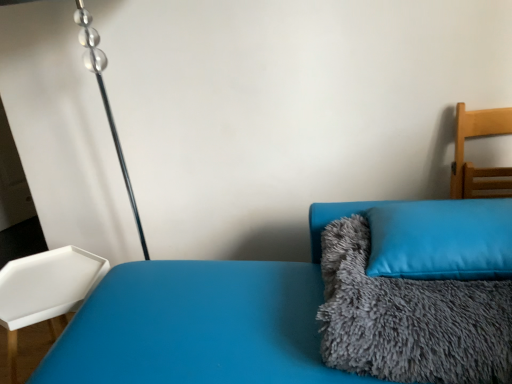
In order to face blue fuzzy couch at center, should I rotate leftwards or rightwards?

You should rotate right by 7.665 degrees.

Image resolution: width=512 pixels, height=384 pixels. Find the location of `white plastic tray at left, the 1th furniture when ordered from bottom to top`. white plastic tray at left, the 1th furniture when ordered from bottom to top is located at coordinates (45, 291).

Image resolution: width=512 pixels, height=384 pixels. What do you see at coordinates (441, 239) in the screenshot?
I see `blue soft cushion at right` at bounding box center [441, 239].

Where is `blue fuzzy couch at center`? The width and height of the screenshot is (512, 384). blue fuzzy couch at center is located at coordinates (203, 322).

Is white plastic tray at left, which ranks as the 1th furniture in left-to-right order, looking in the opposite direction of blue fuzzy couch at center?

No, white plastic tray at left, which ranks as the 1th furniture in left-to-right order, is not facing away from blue fuzzy couch at center.

Looking at this image, can you confirm if white plastic tray at left, the 1th furniture when ordered from bottom to top, is positioned to the left of blue fuzzy couch at center?

Correct, you'll find white plastic tray at left, the 1th furniture when ordered from bottom to top, to the left of blue fuzzy couch at center.

Is white plastic tray at left, which ranks as the 1th furniture in left-to-right order, positioned behind blue fuzzy couch at center?

Yes, the depth of white plastic tray at left, which ranks as the 1th furniture in left-to-right order, is greater than that of blue fuzzy couch at center.

Is white plastic tray at left, which ranks as the 1th furniture in left-to-right order, thinner than blue fuzzy couch at center?

Yes, white plastic tray at left, which ranks as the 1th furniture in left-to-right order, is thinner than blue fuzzy couch at center.

From the image's perspective, which one is positioned higher, blue fuzzy couch at center or blue soft cushion at right?

blue soft cushion at right.

Can you confirm if blue fuzzy couch at center is taller than blue soft cushion at right?

Yes, blue fuzzy couch at center is taller than blue soft cushion at right.

Is the depth of blue fuzzy couch at center greater than that of blue soft cushion at right?

No, blue fuzzy couch at center is closer to the camera.

Are gray fluffy blanket at right and blue soft cushion at right located far from each other?

gray fluffy blanket at right is actually quite close to blue soft cushion at right.

From the picture: Does gray fluffy blanket at right turn towards blue soft cushion at right?

No, gray fluffy blanket at right is not aimed at blue soft cushion at right.

Is point (423, 358) positioned after point (418, 255)?

No.

Is gray fluffy blanket at right not inside blue soft cushion at right?

Yes, gray fluffy blanket at right is not within blue soft cushion at right.

Could you measure the distance between white plastic tray at left, arranged as the second furniture when viewed from the top, and light wood chair at right, arranged as the 2th furniture when viewed from the left?

A distance of 4.28 feet exists between white plastic tray at left, arranged as the second furniture when viewed from the top, and light wood chair at right, arranged as the 2th furniture when viewed from the left.

Between white plastic tray at left, which ranks as the 1th furniture in left-to-right order, and light wood chair at right, arranged as the 2th furniture when viewed from the left, which one is positioned behind?

white plastic tray at left, which ranks as the 1th furniture in left-to-right order, is behind.

Considering the relative sizes of white plastic tray at left, which ranks as the 1th furniture in left-to-right order, and light wood chair at right, arranged as the 2th furniture when viewed from the left, in the image provided, is white plastic tray at left, which ranks as the 1th furniture in left-to-right order, smaller than light wood chair at right, arranged as the 2th furniture when viewed from the left,?

Incorrect, white plastic tray at left, which ranks as the 1th furniture in left-to-right order, is not smaller in size than light wood chair at right, arranged as the 2th furniture when viewed from the left.

Which object is positioned more to the left, white plastic tray at left, which ranks as the 1th furniture in left-to-right order, or light wood chair at right, placed as the 2th furniture when sorted from bottom to top?

white plastic tray at left, which ranks as the 1th furniture in left-to-right order, is more to the left.

Is light wood chair at right, placed as the 2th furniture when sorted from bottom to top, taller or shorter than gray fluffy blanket at right?

In the image, light wood chair at right, placed as the 2th furniture when sorted from bottom to top, appears to be taller than gray fluffy blanket at right.

Is gray fluffy blanket at right at the back of light wood chair at right, arranged as the 1th furniture when viewed from the top?

That's not correct — light wood chair at right, arranged as the 1th furniture when viewed from the top, is not looking away from gray fluffy blanket at right.

Which of these two, light wood chair at right, arranged as the 2th furniture when viewed from the left, or gray fluffy blanket at right, is smaller?

light wood chair at right, arranged as the 2th furniture when viewed from the left.

Considering the relative sizes of light wood chair at right, placed as the 2th furniture when sorted from bottom to top, and gray fluffy blanket at right in the image provided, is light wood chair at right, placed as the 2th furniture when sorted from bottom to top, wider than gray fluffy blanket at right?

In fact, light wood chair at right, placed as the 2th furniture when sorted from bottom to top, might be narrower than gray fluffy blanket at right.

From their relative heights in the image, would you say blue soft cushion at right is taller or shorter than gray fluffy blanket at right?

Considering their sizes, blue soft cushion at right has less height than gray fluffy blanket at right.

Could you tell me if blue soft cushion at right is facing gray fluffy blanket at right?

No, blue soft cushion at right is not turned towards gray fluffy blanket at right.

Would you say blue soft cushion at right is outside gray fluffy blanket at right?

No, blue soft cushion at right is inside or overlapping with gray fluffy blanket at right.

Does white plastic tray at left, the 1th furniture when ordered from bottom to top, appear on the left side of blue soft cushion at right?

Indeed, white plastic tray at left, the 1th furniture when ordered from bottom to top, is positioned on the left side of blue soft cushion at right.

Considering the sizes of white plastic tray at left, marked as the 2th furniture in a right-to-left arrangement, and blue soft cushion at right in the image, is white plastic tray at left, marked as the 2th furniture in a right-to-left arrangement, wider or thinner than blue soft cushion at right?

Considering their sizes, white plastic tray at left, marked as the 2th furniture in a right-to-left arrangement, looks slimmer than blue soft cushion at right.

Where is `furniture below the blue soft cushion at right (from a real-world perspective)`? furniture below the blue soft cushion at right (from a real-world perspective) is located at coordinates (45, 291).

Is white plastic tray at left, the 1th furniture when ordered from bottom to top, oriented away from blue soft cushion at right?

No, white plastic tray at left, the 1th furniture when ordered from bottom to top,'s orientation is not away from blue soft cushion at right.

There is a white plastic tray at left, which ranks as the 1th furniture in left-to-right order. At what (x,y) coordinates should I click in order to perform the action: click on couch above it (from a real-world perspective). Please return your answer as a coordinate pair (x, y). Image resolution: width=512 pixels, height=384 pixels. Looking at the image, I should click on (203, 322).

At what (x,y) coordinates should I click in order to perform the action: click on couch below the blue soft cushion at right (from a real-world perspective). Please return your answer as a coordinate pair (x, y). This screenshot has width=512, height=384. Looking at the image, I should click on (203, 322).

Estimate the real-world distances between objects in this image. Which object is closer to blue fuzzy couch at center, gray fluffy blanket at right or light wood chair at right, the 1th furniture from the right?

gray fluffy blanket at right.

When comparing their distances from blue fuzzy couch at center, does blue soft cushion at right or light wood chair at right, arranged as the 1th furniture when viewed from the top, seem closer?

blue soft cushion at right.

Which object lies further to the anchor point blue soft cushion at right, white plastic tray at left, the 1th furniture when ordered from bottom to top, or gray fluffy blanket at right?

Among the two, white plastic tray at left, the 1th furniture when ordered from bottom to top, is located further to blue soft cushion at right.

Which object lies further to the anchor point blue soft cushion at right, blue fuzzy couch at center or white plastic tray at left, marked as the 2th furniture in a right-to-left arrangement?

white plastic tray at left, marked as the 2th furniture in a right-to-left arrangement.

From the image, which object appears to be nearer to blue fuzzy couch at center, light wood chair at right, placed as the 2th furniture when sorted from bottom to top, or white plastic tray at left, marked as the 2th furniture in a right-to-left arrangement?

white plastic tray at left, marked as the 2th furniture in a right-to-left arrangement, is positioned closer to the anchor blue fuzzy couch at center.

Which object lies further to the anchor point blue soft cushion at right, light wood chair at right, the 1th furniture from the right, or blue fuzzy couch at center?

Among the two, light wood chair at right, the 1th furniture from the right, is located further to blue soft cushion at right.

Looking at the image, which one is located closer to white plastic tray at left, which ranks as the 1th furniture in left-to-right order, gray fluffy blanket at right or blue fuzzy couch at center?

The object closer to white plastic tray at left, which ranks as the 1th furniture in left-to-right order, is blue fuzzy couch at center.

Consider the image. Which object lies further to the anchor point blue fuzzy couch at center, gray fluffy blanket at right or white plastic tray at left, marked as the 2th furniture in a right-to-left arrangement?

white plastic tray at left, marked as the 2th furniture in a right-to-left arrangement, is further to blue fuzzy couch at center.

Identify the location of blanket between blue fuzzy couch at center and light wood chair at right, arranged as the 2th furniture when viewed from the left, along the z-axis. (409, 319).

Identify the location of couch between white plastic tray at left, which ranks as the 1th furniture in left-to-right order, and gray fluffy blanket at right from left to right. The image size is (512, 384). (203, 322).

Locate an element on the screen. couch between white plastic tray at left, marked as the 2th furniture in a right-to-left arrangement, and light wood chair at right, arranged as the 2th furniture when viewed from the left, from left to right is located at coordinates (203, 322).

Identify the location of pillow between white plastic tray at left, the 1th furniture when ordered from bottom to top, and light wood chair at right, arranged as the 2th furniture when viewed from the left. The height and width of the screenshot is (384, 512). (441, 239).